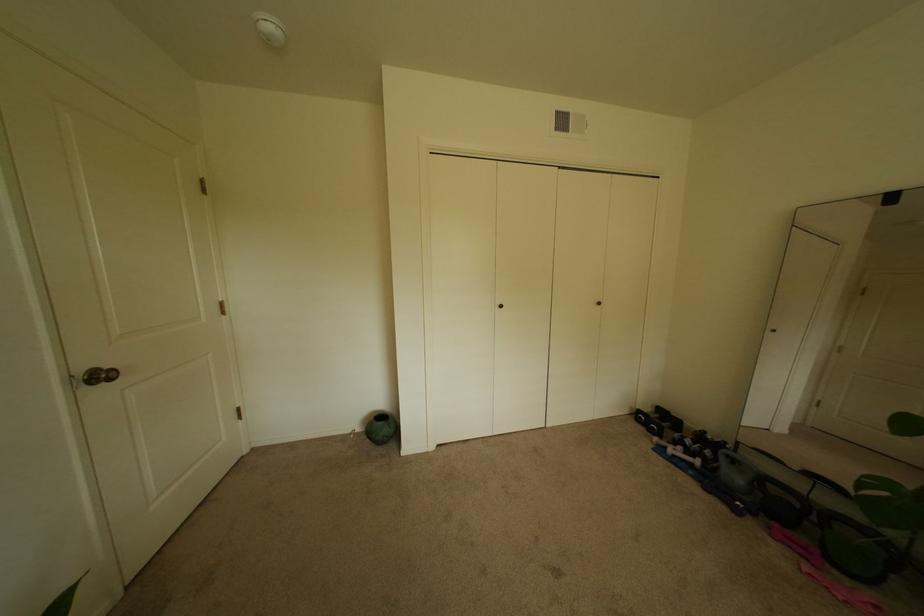
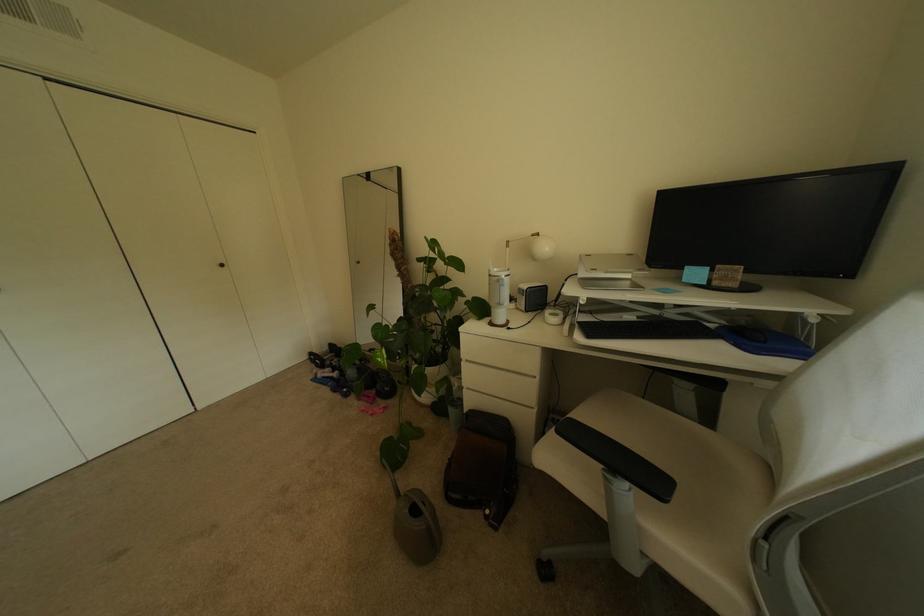
Where in the second image is the point corresponding to point 699,464 from the first image?

(341, 379)